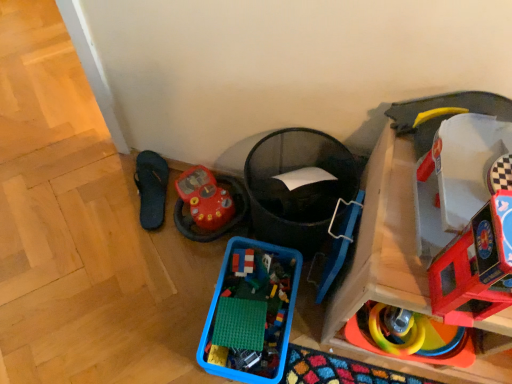
Find the location of a particular element. This screenshot has width=512, height=384. free spot in front of translucent plastic bricks at center, the second toy from the left is located at coordinates (243, 312).